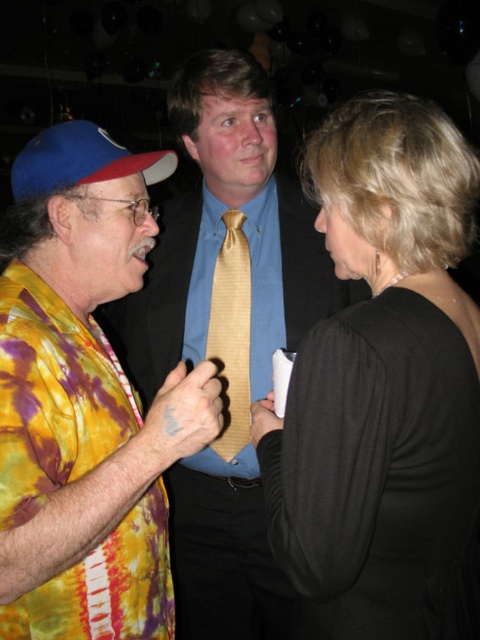
Is point (268, 125) more distant than point (207, 243)?

No, (268, 125) is closer to viewer.

Between matte gold tie at center and blue satin dress shirt at center, which one is positioned lower?

matte gold tie at center

Does point (193, 275) lie in front of point (257, 385)?

No, it is not.

Locate an element on the screen. The width and height of the screenshot is (480, 640). matte gold tie at center is located at coordinates (227, 333).

Is matte gold tie at center above tie-dye fabric shirt at left?

Yes, matte gold tie at center is above tie-dye fabric shirt at left.

Based on the photo, can you confirm if matte gold tie at center is taller than tie-dye fabric shirt at left?

Correct, matte gold tie at center is much taller as tie-dye fabric shirt at left.

What do you see at coordinates (227, 333) in the screenshot?
I see `matte gold tie at center` at bounding box center [227, 333].

At what (x,y) coordinates should I click in order to perform the action: click on matte gold tie at center. Please return your answer as a coordinate pair (x, y). Looking at the image, I should click on (227, 333).

Between black satin dress at center and tie-dye fabric shirt at left, which one appears on the right side from the viewer's perspective?

black satin dress at center is more to the right.

Is point (435, 500) behind point (56, 589)?

No, (435, 500) is closer to viewer.

This screenshot has height=640, width=480. Find the location of `black satin dress at center`. black satin dress at center is located at coordinates (384, 387).